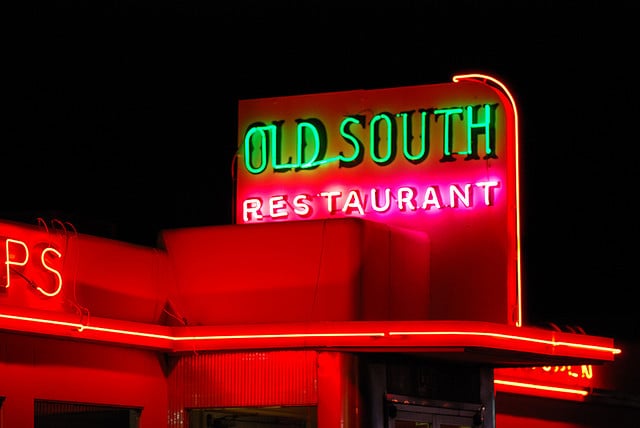
Image resolution: width=640 pixels, height=428 pixels. Identify the location of neon light on sign. (499, 89), (518, 256).